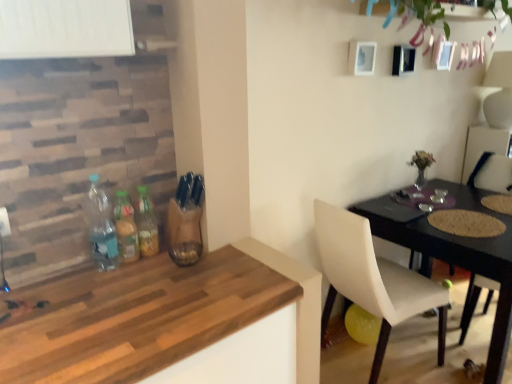
Where is `transparent plastic bottle at left, the third bottle viewed from the right`? transparent plastic bottle at left, the third bottle viewed from the right is located at coordinates (101, 227).

At what (x,y) coordinates should I click in order to perform the action: click on black glossy table at lower right. Please return your answer as a coordinate pair (x, y). Looking at the image, I should click on (457, 256).

Locate an element on the screen. This screenshot has height=384, width=512. translucent plastic bottle at left, which is counted as the second bottle, starting from the left is located at coordinates (126, 228).

Identify the location of transparent plastic bottle at left, the third bottle viewed from the right. This screenshot has width=512, height=384. (101, 227).

From the image's perspective, count 2nd bottles downward from the translucent glass bottles at center, the third bottle viewed from the left, and point to it. Please provide its 2D coordinates.

[(126, 228)]

Are translucent glass bottles at center, which appears as the first bottle when viewed from the right, and translucent plastic bottle at left, which appears as the second bottle when viewed from the right, located far from each other?

No, translucent glass bottles at center, which appears as the first bottle when viewed from the right, is in close proximity to translucent plastic bottle at left, which appears as the second bottle when viewed from the right.

Between translucent glass bottles at center, the third bottle viewed from the left, and translucent plastic bottle at left, which is counted as the second bottle, starting from the left, which one is positioned in front?

translucent plastic bottle at left, which is counted as the second bottle, starting from the left, is closer to the camera.

Does point (344, 250) come closer to viewer compared to point (483, 192)?

That is True.

Considering their positions, is white leather chair at lower right, arranged as the second chair when viewed from the right, located in front of or behind black glossy table at lower right?

white leather chair at lower right, arranged as the second chair when viewed from the right, is positioned closer to the viewer than black glossy table at lower right.

Considering the sizes of objects white leather chair at lower right, arranged as the second chair when viewed from the right, and black glossy table at lower right in the image provided, who is taller, white leather chair at lower right, arranged as the second chair when viewed from the right, or black glossy table at lower right?

With more height is white leather chair at lower right, arranged as the second chair when viewed from the right.

Is white leather chair at lower right, arranged as the second chair when viewed from the right, touching black glossy table at lower right?

They are not placed beside each other.

Considering the sizes of objects wooden textured chair at right, which is the first chair in right-to-left order, and transparent plastic bottle at left, the third bottle viewed from the right, in the image provided, who is thinner, wooden textured chair at right, which is the first chair in right-to-left order, or transparent plastic bottle at left, the third bottle viewed from the right,?

transparent plastic bottle at left, the third bottle viewed from the right.

Consider the image. In the image, is wooden textured chair at right, which is the first chair in right-to-left order, positioned in front of or behind transparent plastic bottle at left, arranged as the first bottle when viewed from the left?

wooden textured chair at right, which is the first chair in right-to-left order, is positioned farther from the viewer than transparent plastic bottle at left, arranged as the first bottle when viewed from the left.

Can you confirm if wooden textured chair at right, which is the first chair in right-to-left order, is positioned to the left of transparent plastic bottle at left, arranged as the first bottle when viewed from the left?

No, wooden textured chair at right, which is the first chair in right-to-left order, is not to the left of transparent plastic bottle at left, arranged as the first bottle when viewed from the left.

Can you see wooden textured chair at right, positioned as the second chair in left-to-right order, touching transparent plastic bottle at left, arranged as the first bottle when viewed from the left?

No, wooden textured chair at right, positioned as the second chair in left-to-right order, is not in contact with transparent plastic bottle at left, arranged as the first bottle when viewed from the left.

The width and height of the screenshot is (512, 384). Identify the location of plant located above the white leather chair at lower right, placed as the 1th chair when sorted from left to right (from the image's perspective). (420, 12).

Is green leafy plant at upper center not close to white leather chair at lower right, arranged as the second chair when viewed from the right?

That's right, there is a large distance between green leafy plant at upper center and white leather chair at lower right, arranged as the second chair when viewed from the right.

From a real-world perspective, which object stands above the other?

green leafy plant at upper center.

Is translucent glass bottles at center, which appears as the first bottle when viewed from the right, touching wooden table at lower left?

There is a gap between translucent glass bottles at center, which appears as the first bottle when viewed from the right, and wooden table at lower left.

Considering the sizes of translucent glass bottles at center, which appears as the first bottle when viewed from the right, and wooden table at lower left in the image, is translucent glass bottles at center, which appears as the first bottle when viewed from the right, taller or shorter than wooden table at lower left?

Considering their sizes, translucent glass bottles at center, which appears as the first bottle when viewed from the right, has less height than wooden table at lower left.

Is translucent glass bottles at center, the third bottle viewed from the left, behind wooden table at lower left?

Yes, it is.

Are translucent glass bottles at center, which appears as the first bottle when viewed from the right, and green leafy plant at upper center located far from each other?

Indeed, translucent glass bottles at center, which appears as the first bottle when viewed from the right, is not near green leafy plant at upper center.

Which point is more forward, (146,211) or (438,14)?

The point (146,211) is closer to the camera.

From a real-world perspective, between translucent glass bottles at center, the third bottle viewed from the left, and green leafy plant at upper center, who is vertically lower?

In real-world perspective, translucent glass bottles at center, the third bottle viewed from the left, is lower.

Based on their positions, is translucent glass bottles at center, which appears as the first bottle when viewed from the right, located to the left or right of green leafy plant at upper center?

translucent glass bottles at center, which appears as the first bottle when viewed from the right, is to the left of green leafy plant at upper center.

In the image, is wooden table at lower left positioned in front of or behind translucent plastic bottle at left, which is counted as the second bottle, starting from the left?

Clearly, wooden table at lower left is in front of translucent plastic bottle at left, which is counted as the second bottle, starting from the left.

Does wooden table at lower left have a smaller size compared to translucent plastic bottle at left, which appears as the second bottle when viewed from the right?

No, wooden table at lower left is not smaller than translucent plastic bottle at left, which appears as the second bottle when viewed from the right.

Considering the positions of point (34, 338) and point (118, 230), is point (34, 338) closer or farther from the camera than point (118, 230)?

Point (34, 338) is closer to the camera than point (118, 230).

Which of these two, wooden table at lower left or translucent plastic bottle at left, which appears as the second bottle when viewed from the right, is wider?

wooden table at lower left is wider.

From the image's perspective, count 2nd bottles upward from the translucent plastic bottle at left, which appears as the second bottle when viewed from the right, and point to it. Please provide its 2D coordinates.

[(146, 224)]

This screenshot has width=512, height=384. Identify the location of chair on the left side of black glossy table at lower right. (372, 279).

When comparing their distances from black glossy table at lower right, does transparent plastic bottle at left, the third bottle viewed from the right, or green leafy plant at upper center seem closer?

green leafy plant at upper center is positioned closer to the anchor black glossy table at lower right.

Based on their spatial positions, is translucent glass bottles at center, the third bottle viewed from the left, or wooden table at lower left closer to wooden textured chair at right, which is the first chair in right-to-left order?

wooden table at lower left lies closer to wooden textured chair at right, which is the first chair in right-to-left order, than the other object.

Estimate the real-world distances between objects in this image. Which object is closer to translucent plastic bottle at left, which appears as the second bottle when viewed from the right, wooden textured chair at right, which is the first chair in right-to-left order, or black glossy table at lower right?

The object closer to translucent plastic bottle at left, which appears as the second bottle when viewed from the right, is black glossy table at lower right.

Looking at the image, which one is located closer to translucent plastic bottle at left, which is counted as the second bottle, starting from the left, black glossy table at lower right or wooden table at lower left?

wooden table at lower left is closer to translucent plastic bottle at left, which is counted as the second bottle, starting from the left.

Estimate the real-world distances between objects in this image. Which object is closer to wooden textured chair at right, positioned as the second chair in left-to-right order, white leather chair at lower right, placed as the 1th chair when sorted from left to right, or transparent plastic bottle at left, arranged as the first bottle when viewed from the left?

The object closer to wooden textured chair at right, positioned as the second chair in left-to-right order, is white leather chair at lower right, placed as the 1th chair when sorted from left to right.

Estimate the real-world distances between objects in this image. Which object is closer to transparent plastic bottle at left, arranged as the first bottle when viewed from the left, white leather chair at lower right, arranged as the second chair when viewed from the right, or translucent glass bottles at center, the third bottle viewed from the left?

translucent glass bottles at center, the third bottle viewed from the left, lies closer to transparent plastic bottle at left, arranged as the first bottle when viewed from the left, than the other object.

Based on their spatial positions, is white leather chair at lower right, placed as the 1th chair when sorted from left to right, or black glossy table at lower right further from wooden textured chair at right, positioned as the second chair in left-to-right order?

white leather chair at lower right, placed as the 1th chair when sorted from left to right, lies further to wooden textured chair at right, positioned as the second chair in left-to-right order, than the other object.

Considering their positions, is wooden table at lower left positioned further to translucent glass bottles at center, the third bottle viewed from the left, than white leather chair at lower right, arranged as the second chair when viewed from the right?

white leather chair at lower right, arranged as the second chair when viewed from the right, lies further to translucent glass bottles at center, the third bottle viewed from the left, than the other object.

Where is `bottle located between translucent plastic bottle at left, which is counted as the second bottle, starting from the left, and green leafy plant at upper center in the left-right direction`? Image resolution: width=512 pixels, height=384 pixels. bottle located between translucent plastic bottle at left, which is counted as the second bottle, starting from the left, and green leafy plant at upper center in the left-right direction is located at coordinates (146, 224).

Where is `chair situated between translucent glass bottles at center, which appears as the first bottle when viewed from the right, and wooden textured chair at right, positioned as the second chair in left-to-right order, from left to right`? chair situated between translucent glass bottles at center, which appears as the first bottle when viewed from the right, and wooden textured chair at right, positioned as the second chair in left-to-right order, from left to right is located at coordinates (372, 279).

You are a GUI agent. You are given a task and a screenshot of the screen. Output one action in this format:
    pyautogui.click(x=<x>, y=<y>)
    Task: Click on the bottle located between translucent plastic bottle at left, which appears as the second bottle when viewed from the right, and black glossy table at lower right in the left-right direction
    
    Given the screenshot: What is the action you would take?
    pyautogui.click(x=146, y=224)

At what (x,y) coordinates should I click in order to perform the action: click on plant located between transparent plastic bottle at left, the third bottle viewed from the right, and wooden textured chair at right, which is the first chair in right-to-left order, in the left-right direction. Please return your answer as a coordinate pair (x, y). Looking at the image, I should click on (420, 12).